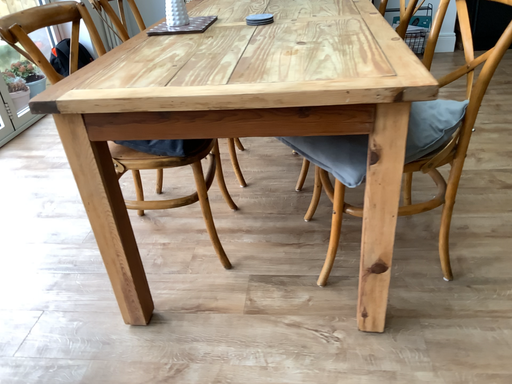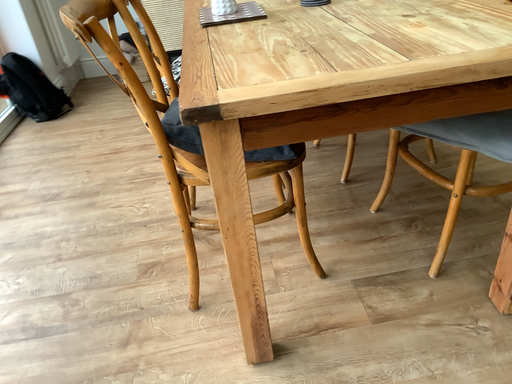
Question: How did the camera likely rotate when shooting the video?

Choices:
 (A) rotated right
 (B) rotated left

Answer: (A)